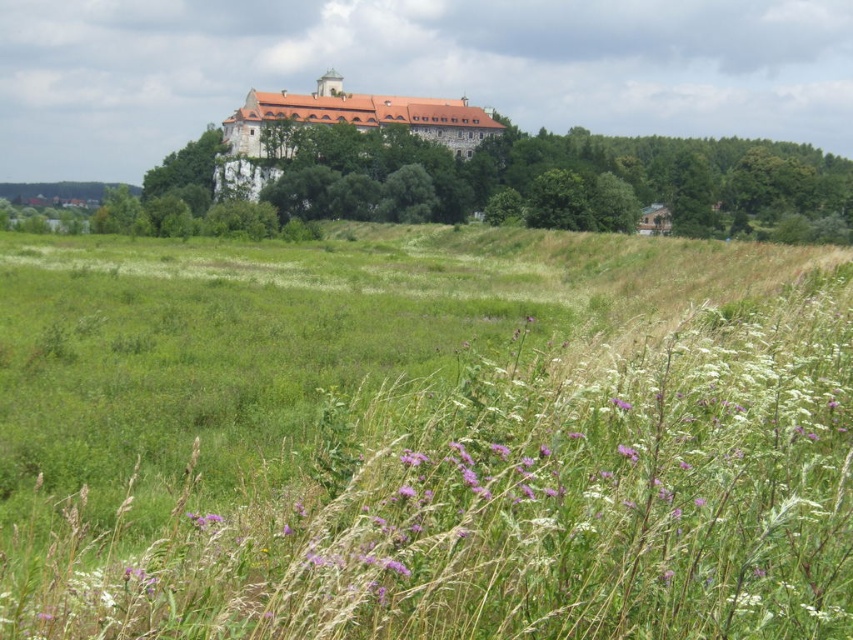
Question: Is brown stone castle at upper center thinner than green leafy tree at upper center?

Choices:
 (A) no
 (B) yes

Answer: (A)

Question: Can you confirm if brown stone castle at upper center is positioned below green leafy tree at upper center?

Choices:
 (A) yes
 (B) no

Answer: (B)

Question: Is brown stone castle at upper center thinner than green leafy tree at upper center?

Choices:
 (A) yes
 (B) no

Answer: (B)

Question: Which object appears farthest from the camera in this image?

Choices:
 (A) green leafy tree at upper center
 (B) purple matte flower at center
 (C) brown stone castle at upper center

Answer: (C)

Question: Which is nearer to the purple matte flower at center?

Choices:
 (A) brown stone castle at upper center
 (B) green leafy tree at upper center

Answer: (B)

Question: Which object appears farthest from the camera in this image?

Choices:
 (A) green leafy tree at upper center
 (B) purple matte flower at center

Answer: (A)